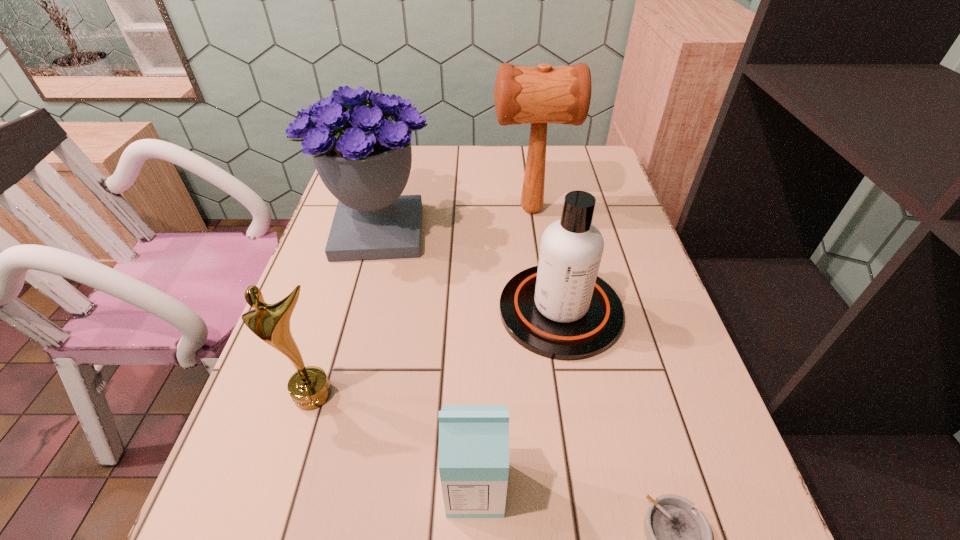
This screenshot has width=960, height=540. Identify the location of free location located on the front-facing side of the award. 272,531.

Image resolution: width=960 pixels, height=540 pixels. What are the coordinates of `free space located 0.260m on the left of the fifth tallest object` in the screenshot? It's located at (288, 488).

Where is `bouquet at the left edge`? Image resolution: width=960 pixels, height=540 pixels. bouquet at the left edge is located at coordinates (363, 155).

Where is `award at the left edge`? This screenshot has height=540, width=960. award at the left edge is located at coordinates (309, 387).

The width and height of the screenshot is (960, 540). I want to click on mallet at the right edge, so click(539, 95).

At what (x,y) coordinates should I click in order to perform the action: click on cleansing agent present at the right edge. Please return your answer as a coordinate pair (x, y). Looking at the image, I should click on point(560,309).

Find the location of a particular element. This screenshot has height=540, width=960. vacant position at the far edge of the desktop is located at coordinates (546, 167).

Identify the location of vacant space at the near edge of the desktop. (509, 530).

Identify the location of free location at the left edge. (311, 289).

Where is `vacant space at the right edge`? The width and height of the screenshot is (960, 540). vacant space at the right edge is located at coordinates (622, 231).